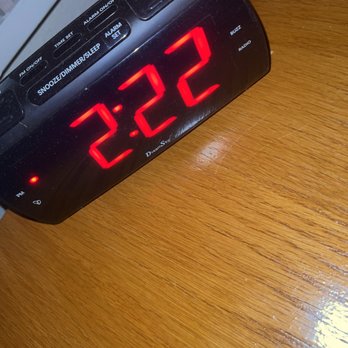
Where is `clock`? This screenshot has height=348, width=348. clock is located at coordinates (90, 79).